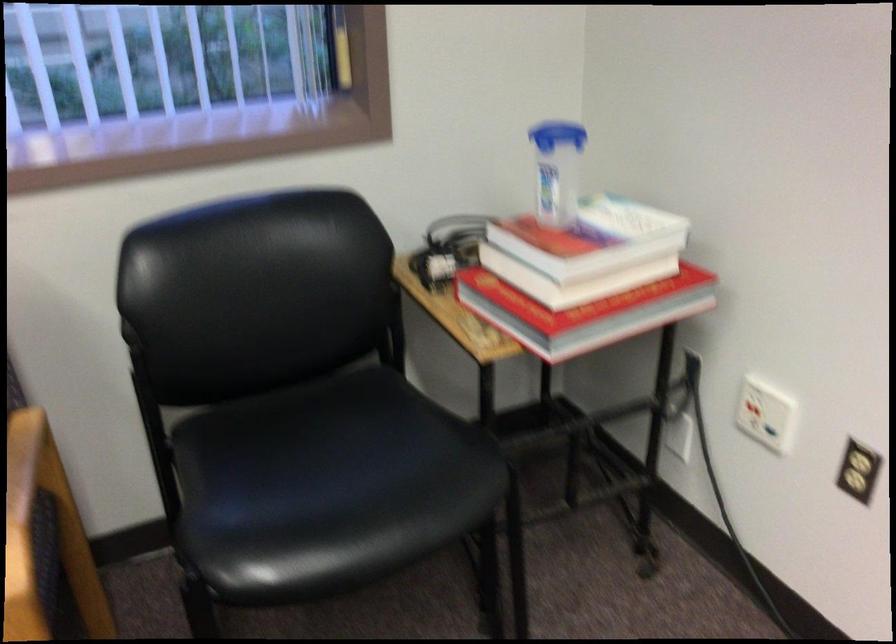
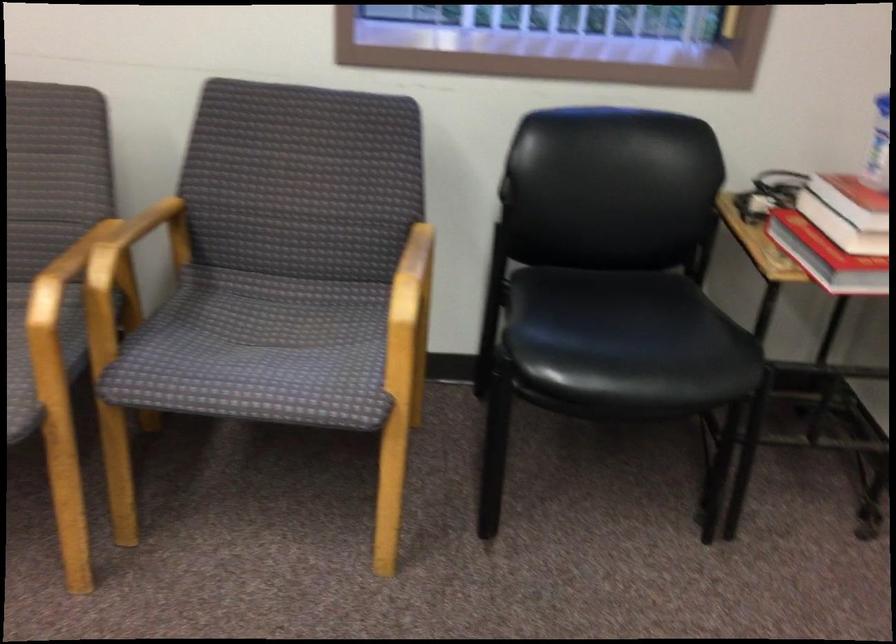
Question: The images are taken continuously from a first-person perspective. In which direction is your viewpoint rotating?

Choices:
 (A) Left
 (B) Right
 (C) Up
 (D) Down

Answer: (A)